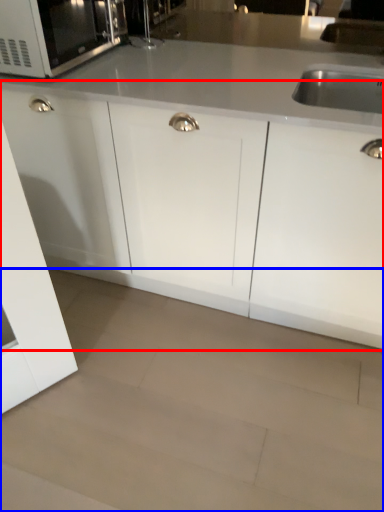
Question: Which object appears closest to the camera in this image, cabinetry (highlighted by a red box) or granite (highlighted by a blue box)?

Choices:
 (A) cabinetry
 (B) granite

Answer: (B)